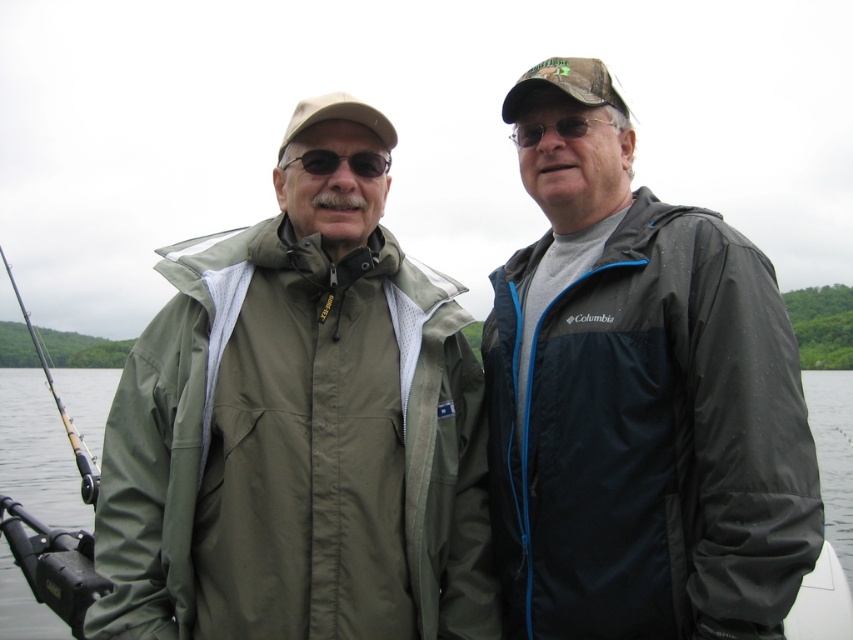
Question: Is matte black jacket at center thinner than matte black sunglasses at upper center?

Choices:
 (A) no
 (B) yes

Answer: (A)

Question: Which point appears closest to the camera in this image?

Choices:
 (A) (15, 570)
 (B) (547, 248)
 (C) (517, 131)

Answer: (C)

Question: Is matte black jacket at center wider than matte black sunglasses at center?

Choices:
 (A) yes
 (B) no

Answer: (B)

Question: Does matte black jacket at center have a smaller size compared to matte black sunglasses at upper center?

Choices:
 (A) no
 (B) yes

Answer: (A)

Question: Which point is closer to the camera taking this photo?

Choices:
 (A) (80, 436)
 (B) (218, 429)

Answer: (B)

Question: Among these objects, which one is nearest to the camera?

Choices:
 (A) matte black fishing pole at left
 (B) olive green fabric jacket at left

Answer: (B)